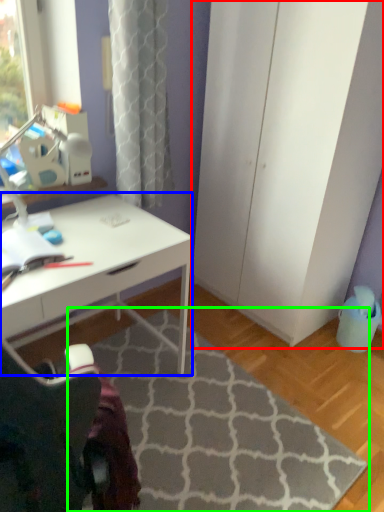
Question: Estimate the real-world distances between objects in this image. Which object is farther from screen door (highlighted by a red box), desk (highlighted by a blue box) or doormat (highlighted by a green box)?

Choices:
 (A) desk
 (B) doormat

Answer: (B)